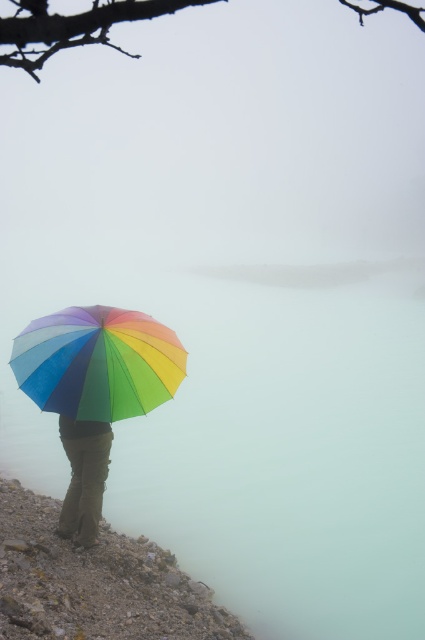
You are a photographer trying to capture the rainbow fabric umbrella at center in the image. What are the exact coordinates where you should focus your camera to ensure the umbrella is centered in the frame?

The rainbow fabric umbrella at center is located at coordinates point (98, 362), so you should focus your camera at those exact coordinates to center it in the frame.